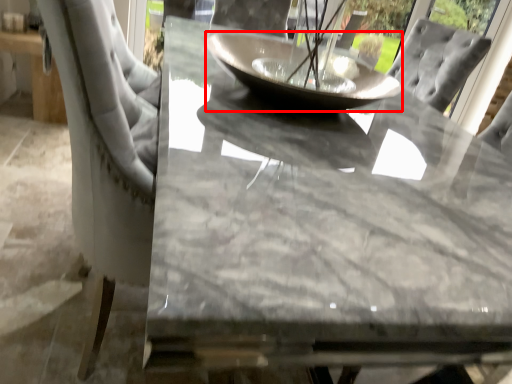
Question: From the image's perspective, where is glass bowl (annotated by the red box) located in relation to table in the image?

Choices:
 (A) below
 (B) above

Answer: (B)